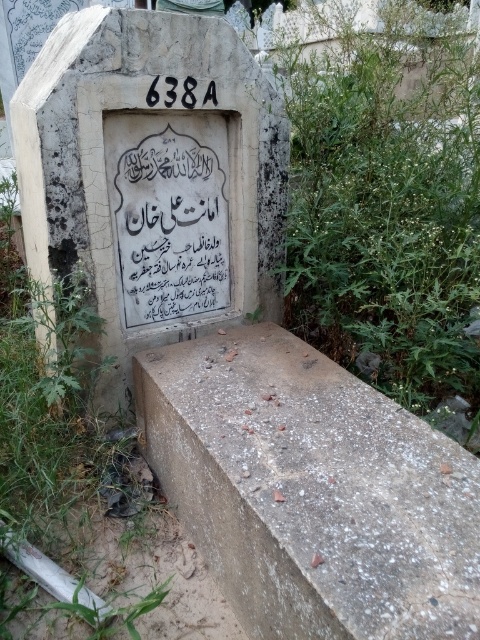
You are standing in a cemetery and see a white stone gravestone at center. There is a point marked at coordinates [153,177]. Where exactly is this point located?

The point marked at coordinates [153,177] is on the white stone gravestone at center.

You are standing in a cemetery and want to take a photo of the white stone gravestone at center. Your camera has a minimum focus distance of 2 meters. Will you be able to focus on the gravestone from your current position?

The white stone gravestone at center is 1.59 meters away from viewer, which is less than the camera minimum focus distance of 2 meters. Therefore, you cannot focus on the gravestone from your current position.

You are standing in front of the tombstone and want to place a small potted plant on the ground. The gray concrete at lower center and the green leafy plant at lower right are both visible. Which surface would you place the pot on to ensure it is closer to the tombstone?

The gray concrete at lower center is located below the green leafy plant at lower right, so placing the pot on the gray concrete at lower center would position it closer to the tombstone.